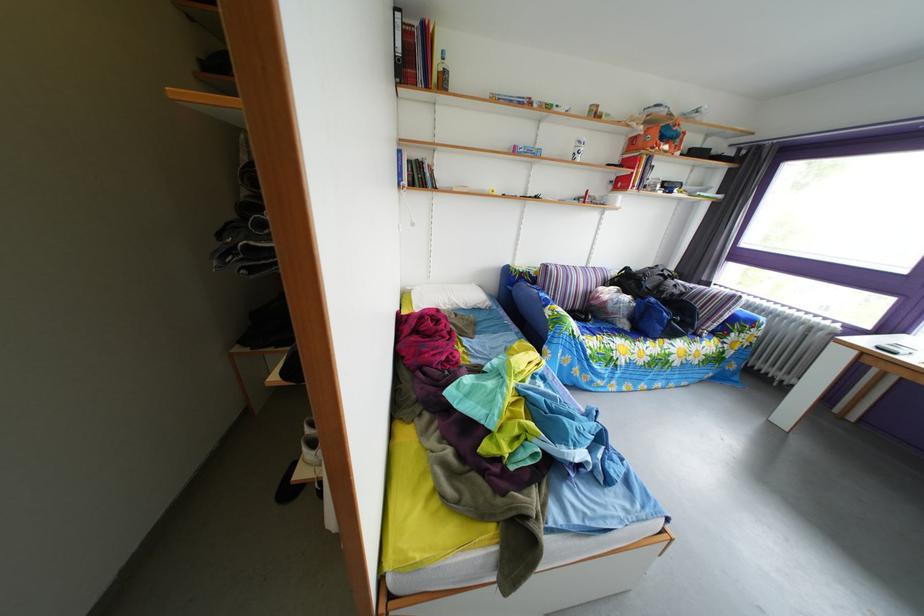
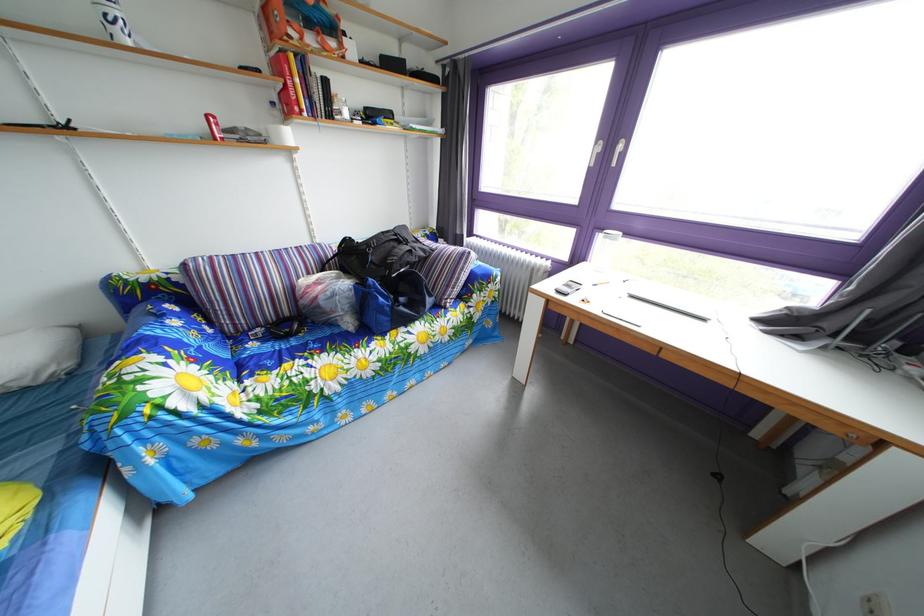
In the second image, find the point that corresponds to point (673, 147) in the first image.

(320, 33)